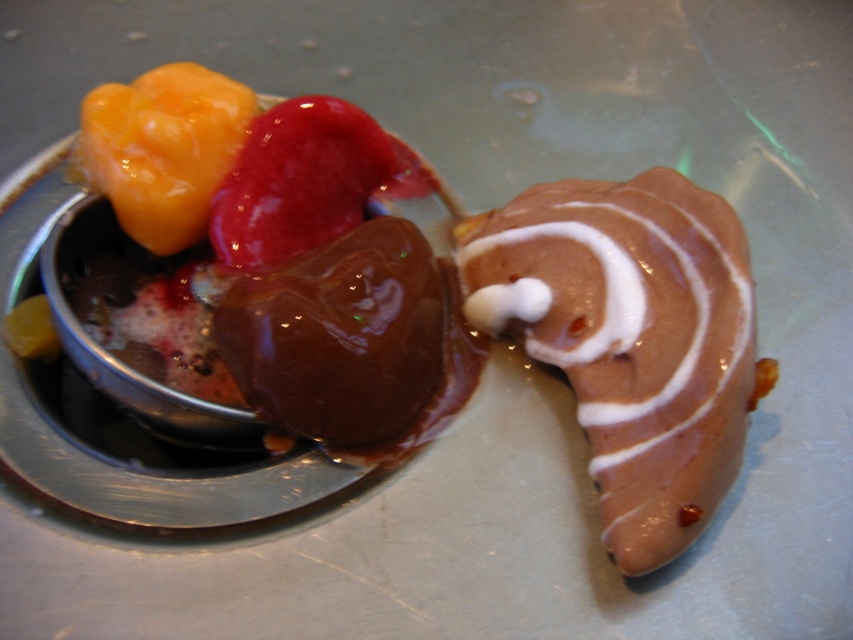
Does point (576, 330) come farther from viewer compared to point (242, 257)?

That is False.

Who is taller, chocolate glaze donut at right or shiny red ice cream at center?

With more height is chocolate glaze donut at right.

Where is `chocolate glaze donut at right`? Image resolution: width=853 pixels, height=640 pixels. chocolate glaze donut at right is located at coordinates (630, 339).

Find the location of a particular element. This screenshot has width=853, height=640. chocolate glaze donut at right is located at coordinates (630, 339).